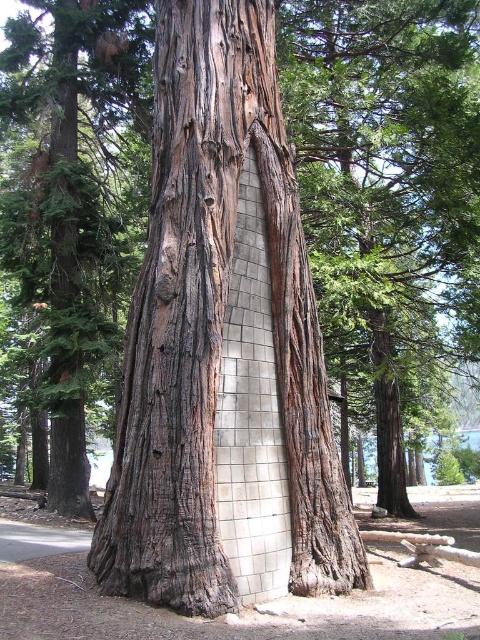
You are a park ranger measuring the space between two trees in the center of the park. The smooth bark tree trunk at center and the rough bark tree at center are both in the middle. Can you fit a 4.5 meter long bench between them?

The distance between the smooth bark tree trunk at center and the rough bark tree at center is 4.67 meters, so yes, a 4.5 meter long bench can fit between them since the space is slightly larger than the bench.

Looking at this image, you are a botanist examining two trees in the scene. You notice that the smooth bark tree trunk at center and the rough bark tree at center have different widths. Which one is narrower?

The smooth bark tree trunk at center is narrower than the rough bark tree at center.